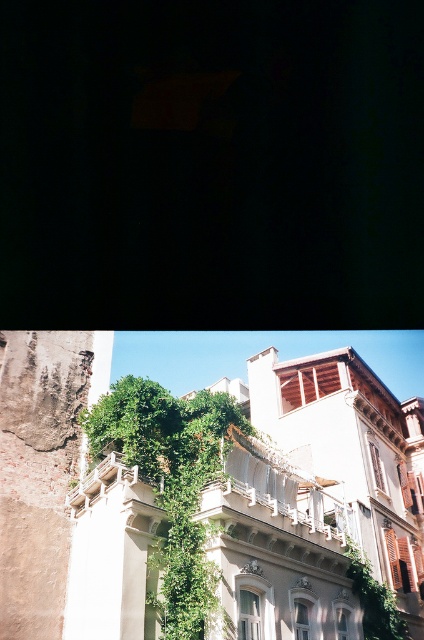
Does green leafy ivy at center come behind white stone balcony at center?

No, it is not.

Does green leafy ivy at center have a greater height compared to white stone balcony at center?

Indeed, green leafy ivy at center has a greater height compared to white stone balcony at center.

Is point (212, 582) farther from camera compared to point (270, 486)?

No, (212, 582) is in front of (270, 486).

Image resolution: width=424 pixels, height=640 pixels. Identify the location of green leafy ivy at center. (172, 483).